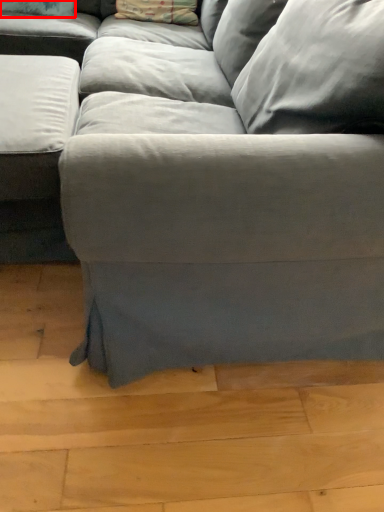
Question: From the image's perspective, what is the correct spatial relationship of pillow (annotated by the red box) in relation to pillow?

Choices:
 (A) below
 (B) above

Answer: (A)